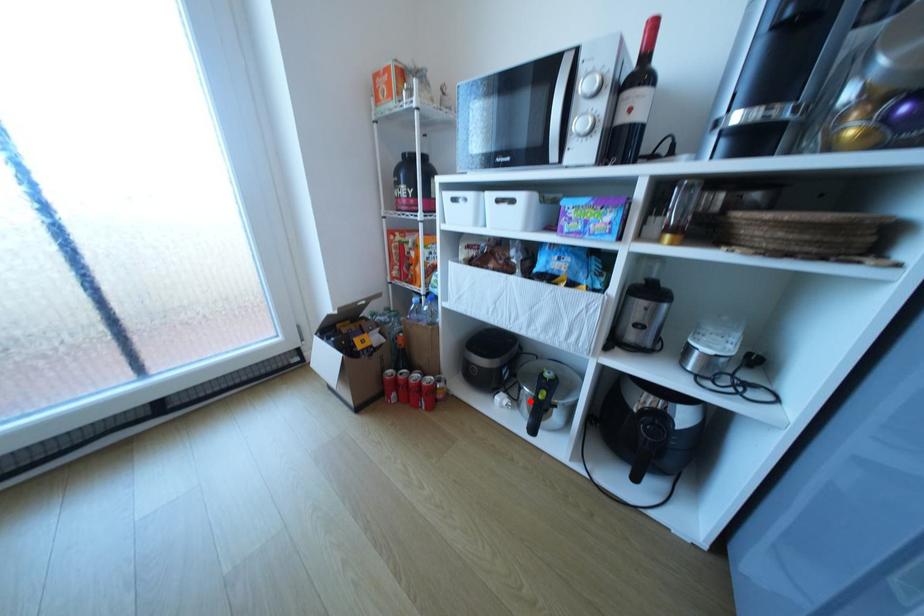
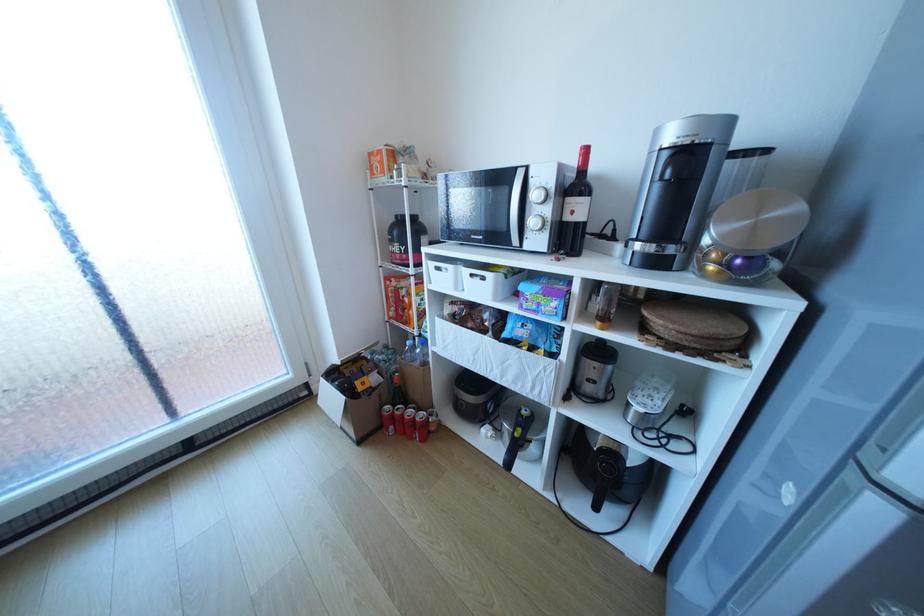
Question: I am providing you with two images of the same scene from different viewpoints. A red point is shown in image1. For the corresponding object point in image2, is it positioned nearer or farther from the camera?

Choices:
 (A) Nearer
 (B) Farther

Answer: (B)